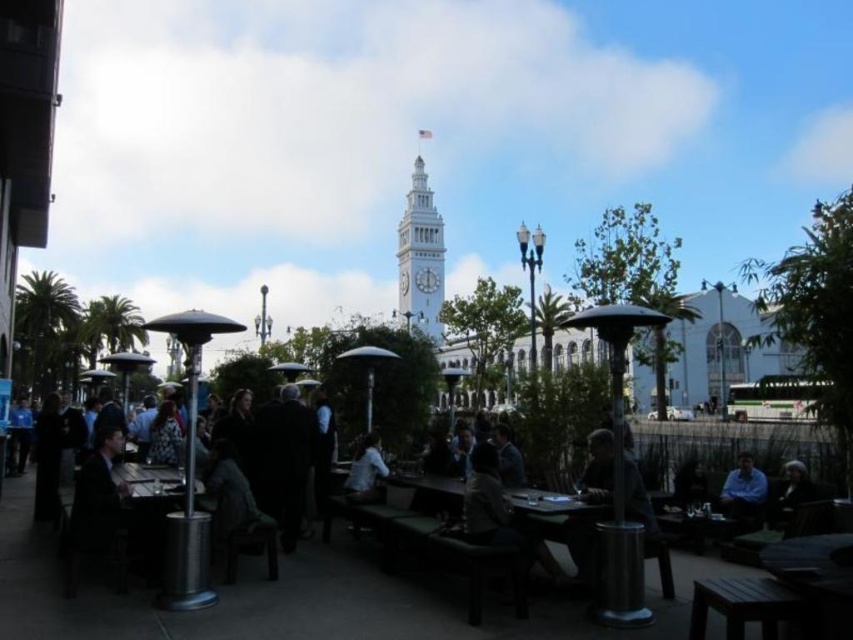
Question: Which object appears farthest from the camera in this image?

Choices:
 (A) dark gray jacket at center
 (B) dark brown leather jacket at lower right
 (C) dark brown wood picnic table at lower right
 (D) blue shirt at lower right

Answer: (D)

Question: Is dark brown wood picnic table at lower right smaller than blue shirt at lower right?

Choices:
 (A) no
 (B) yes

Answer: (A)

Question: Estimate the real-world distances between objects in this image. Which object is closer to the dark gray jacket at center?

Choices:
 (A) white painted metal clock tower at center
 (B) blue shirt at lower right
 (C) dark brown leather jacket at lower right
 (D) dark brown wood picnic table at lower right

Answer: (D)

Question: Considering the real-world distances, which object is farthest from the blue shirt at lower right?

Choices:
 (A) dark brown wood picnic table at lower right
 (B) white painted metal clock tower at center
 (C) dark gray jacket at center

Answer: (B)

Question: From the image, what is the correct spatial relationship of dark brown wood picnic table at lower right in relation to blue shirt at lower right?

Choices:
 (A) below
 (B) above

Answer: (A)

Question: Can you confirm if white painted metal clock tower at center is positioned below dark brown leather jacket at lower right?

Choices:
 (A) yes
 (B) no

Answer: (B)